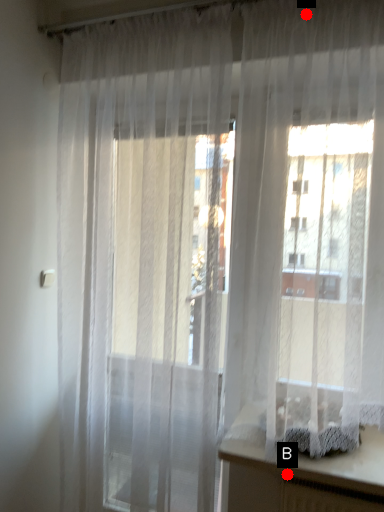
Question: Two points are circled on the image, labeled by A and B beside each circle. Which of the following is the farthest from the observer?

Choices:
 (A) A is further
 (B) B is further

Answer: (A)